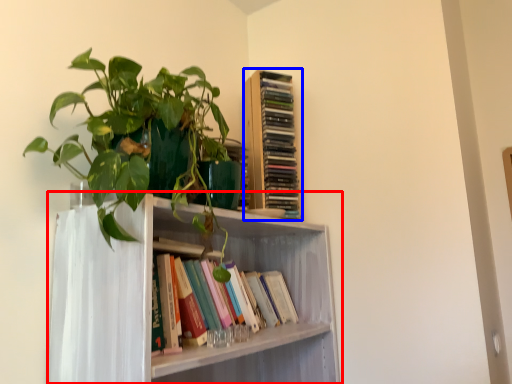
Question: Which object appears farthest to the camera in this image, shelf (highlighted by a red box) or book (highlighted by a blue box)?

Choices:
 (A) shelf
 (B) book

Answer: (B)